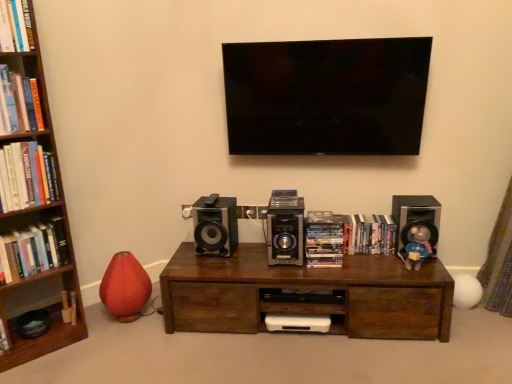
Question: From a real-world perspective, does hardcover book at left, which is the 5th book in right-to-left order, sit lower than wooden bookcase at left?

Choices:
 (A) yes
 (B) no

Answer: (B)

Question: From a real-world perspective, is hardcover book at left, which is the 5th book in right-to-left order, located higher than wooden bookcase at left?

Choices:
 (A) yes
 (B) no

Answer: (A)

Question: From the image's perspective, does hardcover book at left, which is the 5th book in right-to-left order, appear lower than wooden bookcase at left?

Choices:
 (A) yes
 (B) no

Answer: (B)

Question: Is hardcover book at left, the second book positioned from the left, looking in the opposite direction of wooden bookcase at left?

Choices:
 (A) yes
 (B) no

Answer: (A)

Question: Does hardcover book at left, which is the 5th book in right-to-left order, have a lesser width compared to wooden bookcase at left?

Choices:
 (A) yes
 (B) no

Answer: (A)

Question: Is hardcover book at left, which is the 5th book in right-to-left order, further to the viewer compared to wooden bookcase at left?

Choices:
 (A) no
 (B) yes

Answer: (B)

Question: Considering the relative sizes of hardcover books at left, which appears as the 1th book when viewed from the left, and hardcover book at upper left, the 3th book positioned from the right, in the image provided, is hardcover books at left, which appears as the 1th book when viewed from the left, shorter than hardcover book at upper left, the 3th book positioned from the right,?

Choices:
 (A) yes
 (B) no

Answer: (B)

Question: Would you say hardcover books at left, which appears as the 1th book when viewed from the left, contains hardcover book at upper left, the 3th book positioned from the right?

Choices:
 (A) yes
 (B) no

Answer: (B)

Question: Is hardcover books at left, which appears as the 6th book when viewed from the right, at the left side of hardcover book at upper left, the 4th book when ordered from left to right?

Choices:
 (A) yes
 (B) no

Answer: (A)

Question: From a real-world perspective, does hardcover books at left, which appears as the 6th book when viewed from the right, stand above hardcover book at upper left, the 3th book positioned from the right?

Choices:
 (A) yes
 (B) no

Answer: (B)

Question: Does hardcover books at left, which appears as the 6th book when viewed from the right, lie behind hardcover book at upper left, the 4th book when ordered from left to right?

Choices:
 (A) yes
 (B) no

Answer: (A)

Question: Can you confirm if hardcover books at left, which appears as the 6th book when viewed from the right, is thinner than hardcover book at upper left, the 3th book positioned from the right?

Choices:
 (A) no
 (B) yes

Answer: (B)

Question: From a real-world perspective, is hardcover books at left, the 3th book in the left-to-right sequence, positioned under shiny plastic dvds at center, the 2th book viewed from the right, based on gravity?

Choices:
 (A) yes
 (B) no

Answer: (B)